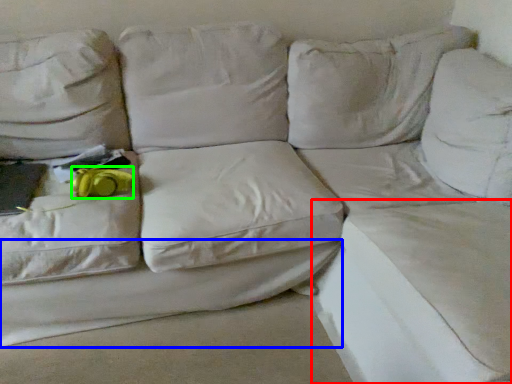
Question: Which object is the farthest from sheet (highlighted by a red box)? Choose among these: sheet (highlighted by a blue box) or stuff (highlighted by a green box).

Choices:
 (A) sheet
 (B) stuff

Answer: (B)